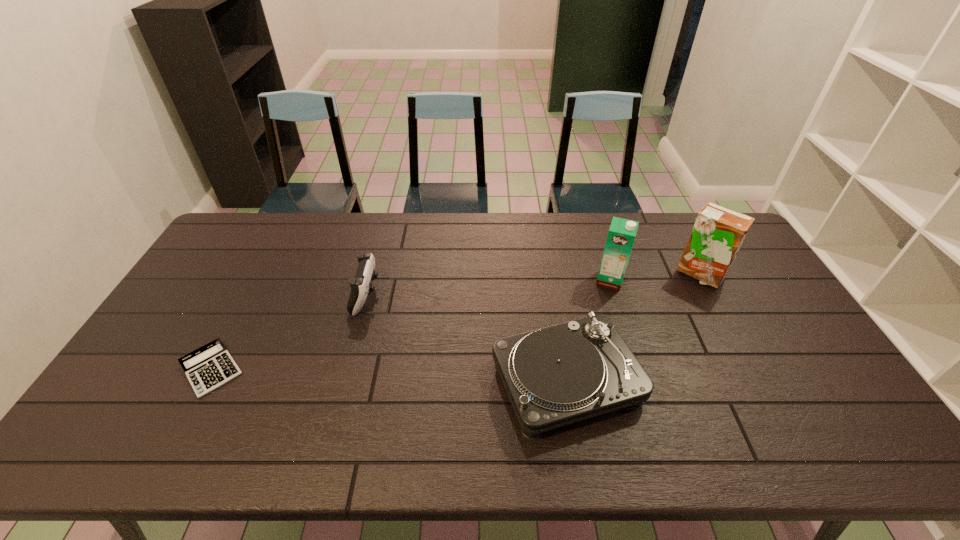
Find the location of a particular element. free space that satisfies the following two spatial constraints: 1. on the front-facing side of the control; 2. on the right side of the record player is located at coordinates (344, 381).

At what (x,y) coordinates should I click in order to perform the action: click on vacant point that satisfies the following two spatial constraints: 1. on the front side of the shortest object; 2. on the right side of the record player. Please return your answer as a coordinate pair (x, y). The width and height of the screenshot is (960, 540). Looking at the image, I should click on (204, 381).

In order to click on vacant space that satisfies the following two spatial constraints: 1. on the front-facing side of the fourth object from right to left; 2. on the front side of the calculator in this screenshot , I will do `click(347, 369)`.

Locate an element on the screen. This screenshot has width=960, height=540. vacant space that satisfies the following two spatial constraints: 1. on the front-facing side of the record player; 2. on the left side of the control is located at coordinates (344, 381).

Where is `vacant space that satisfies the following two spatial constraints: 1. on the back side of the leftmost object; 2. on the right side of the left carton`? The width and height of the screenshot is (960, 540). vacant space that satisfies the following two spatial constraints: 1. on the back side of the leftmost object; 2. on the right side of the left carton is located at coordinates (258, 280).

The image size is (960, 540). Find the location of `vacant space that satisfies the following two spatial constraints: 1. on the front-facing side of the fourth object from right to left; 2. on the right side of the record player`. vacant space that satisfies the following two spatial constraints: 1. on the front-facing side of the fourth object from right to left; 2. on the right side of the record player is located at coordinates (344, 381).